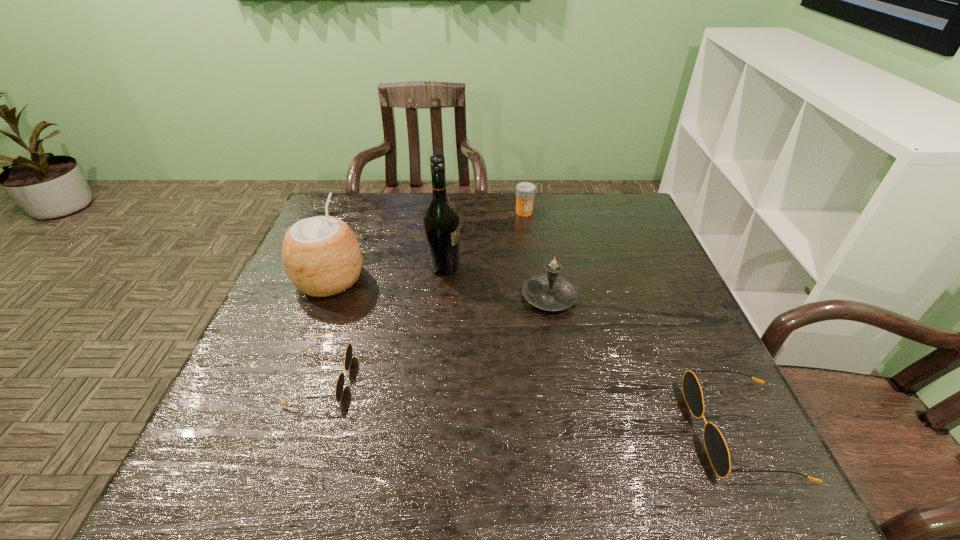
Choose which object is the fourth nearest neighbor to the third shortest object. Please provide its 2D coordinates. Your answer should be formatted as a tuple, i.e. [(x, y)], where the tuple contains the x and y coordinates of a point satisfying the conditions above.

[(340, 382)]

Where is `vacant region that satisfies the following two spatial constraints: 1. on the label side of the medicine; 2. on the right side of the candle`? vacant region that satisfies the following two spatial constraints: 1. on the label side of the medicine; 2. on the right side of the candle is located at coordinates (536, 297).

Where is `vacant point that satisfies the following two spatial constraints: 1. on the front side of the fourth shortest object; 2. on the front-facing side of the shorter sunglasses`? This screenshot has height=540, width=960. vacant point that satisfies the following two spatial constraints: 1. on the front side of the fourth shortest object; 2. on the front-facing side of the shorter sunglasses is located at coordinates (564, 379).